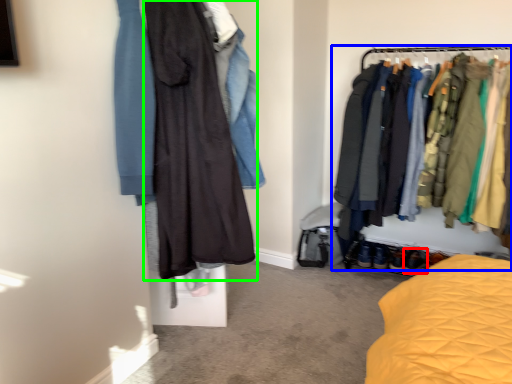
Question: Considering the real-world distances, which object is closest to footwear (highlighted by a red box)? closet (highlighted by a blue box) or fancy dress (highlighted by a green box).

Choices:
 (A) closet
 (B) fancy dress

Answer: (A)